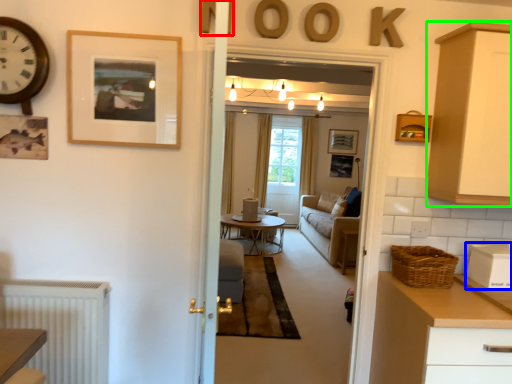
Question: Which object is positioned farthest from letter (highlighted by a red box)? Select from appliance (highlighted by a blue box) and cabinetry (highlighted by a green box).

Choices:
 (A) appliance
 (B) cabinetry

Answer: (A)